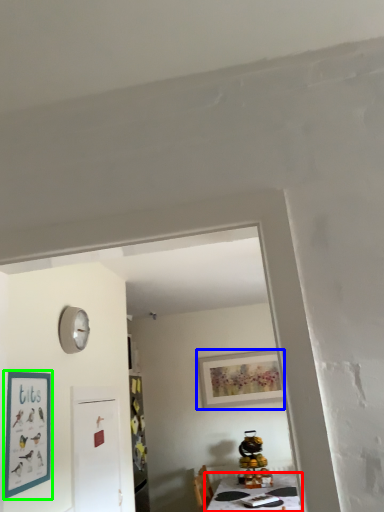
Question: Which is nearer to the table (highlighted by a red box)? picture frame (highlighted by a blue box) or picture frame (highlighted by a green box).

Choices:
 (A) picture frame
 (B) picture frame

Answer: (A)